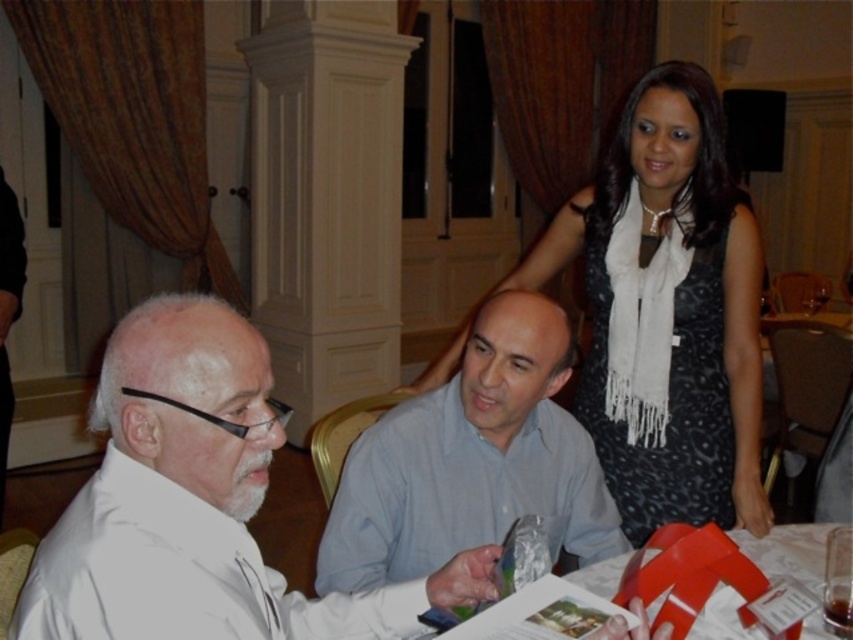
Question: Does white matte shirt at left have a greater width compared to matte red paper at lower right?

Choices:
 (A) yes
 (B) no

Answer: (B)

Question: Does light blue shirt at center have a larger size compared to matte red paper at lower right?

Choices:
 (A) no
 (B) yes

Answer: (B)

Question: Among these points, which one is nearest to the camera?

Choices:
 (A) (198, 580)
 (B) (488, 320)

Answer: (A)

Question: Among these objects, which one is farthest from the camera?

Choices:
 (A) white matte shirt at left
 (B) light blue shirt at center
 (C) black dress at upper right
 (D) matte red paper at lower right

Answer: (C)

Question: Which of the following is the farthest from the observer?

Choices:
 (A) black dress at upper right
 (B) light blue shirt at center
 (C) matte red paper at lower right
 (D) white matte shirt at left

Answer: (A)

Question: Does light blue shirt at center appear on the right side of matte red paper at lower right?

Choices:
 (A) yes
 (B) no

Answer: (B)